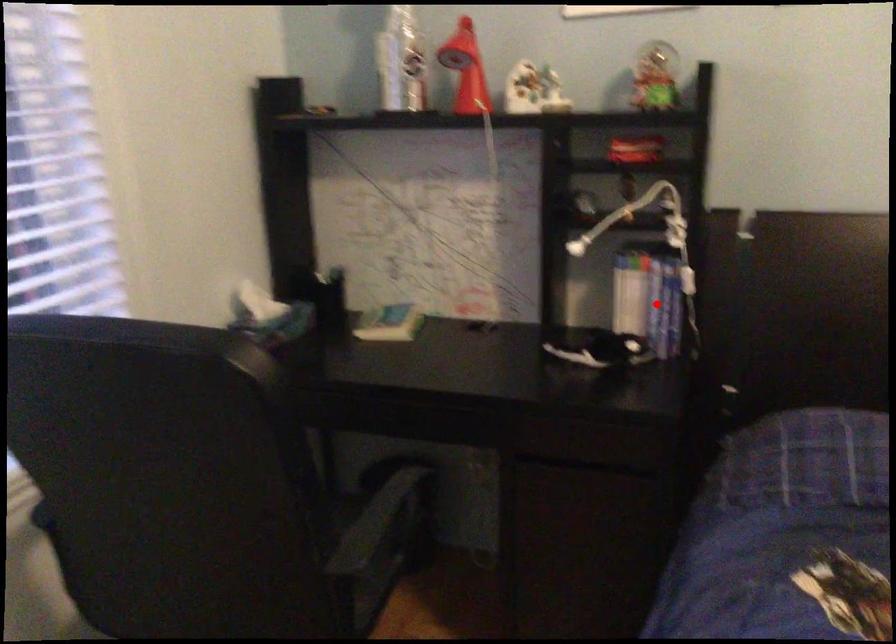
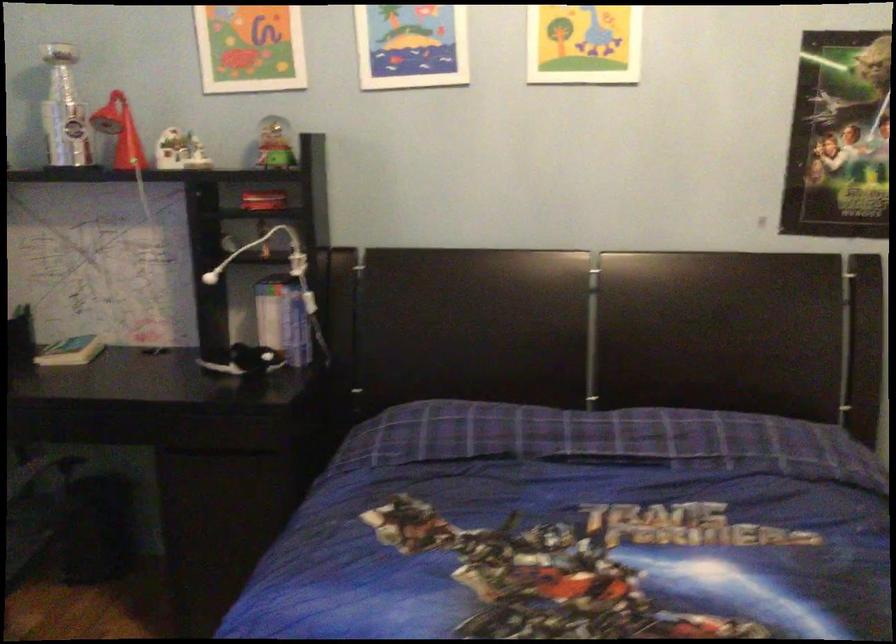
The point at the highlighted location is marked in the first image. Where is the corresponding point in the second image?

(288, 321)